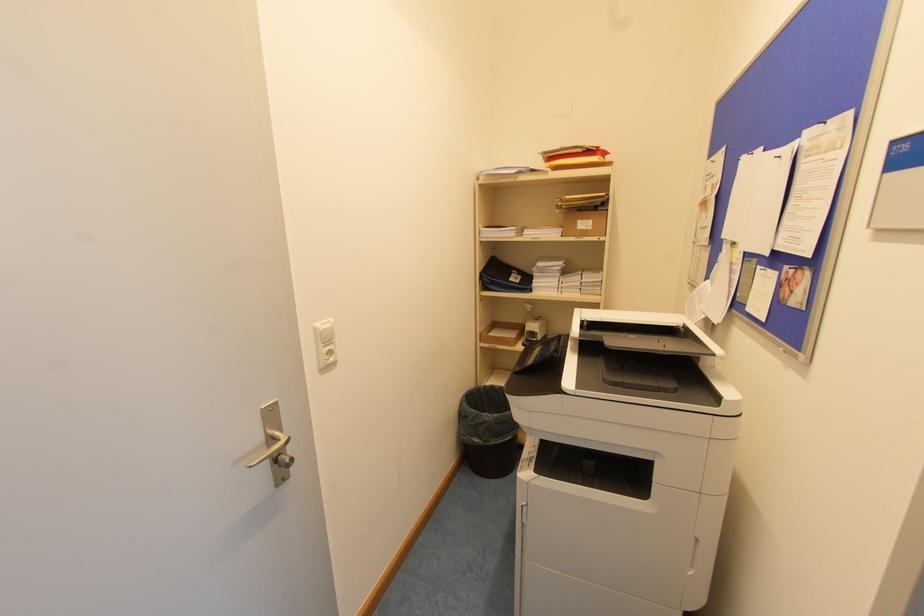
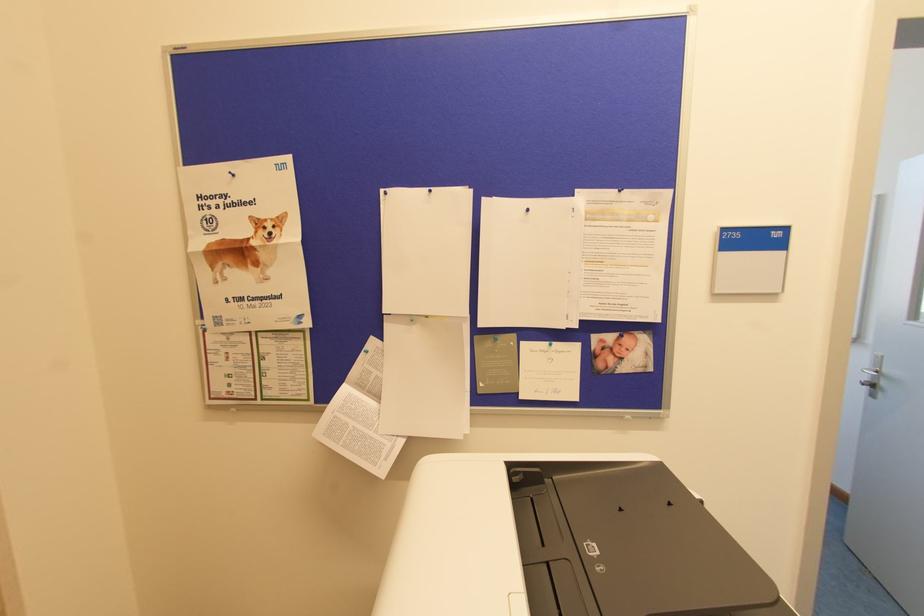
The point at (751, 153) is marked in the first image. Where is the corresponding point in the second image?

(430, 191)